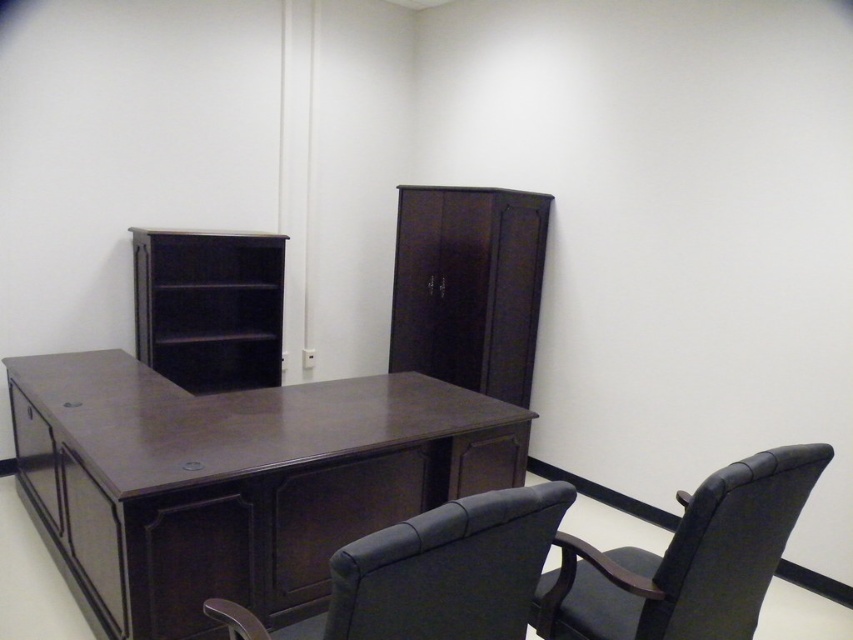
You are sitting in the black leather chair at lower right and want to reach the dark wood drawer at lower left. Which direction should you move to get closer to the drawer?

You should move to the left to get closer to the dark wood drawer at lower left since the black leather chair at lower right is positioned to the right of it.

You are standing in the office and want to take a photo of the point at coordinate (33,464). If your camera is 3.11 meters away from the point, is the camera close enough to capture the point clearly?

The point at coordinate (33,464) is 3.11 meters away from the camera, so the camera is at the correct distance to capture the point clearly.